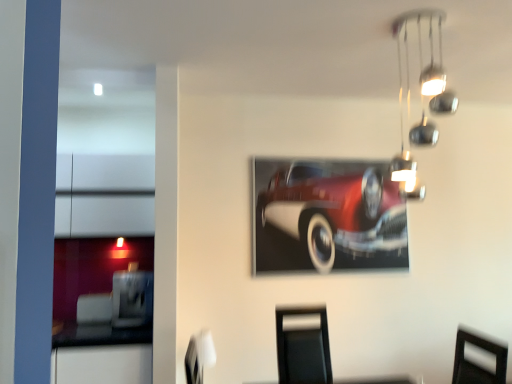
Question: From a real-world perspective, is shiny red car at center physically above white fabric swivel chair at lower center?

Choices:
 (A) yes
 (B) no

Answer: (A)

Question: Does shiny red car at center have a lesser height compared to white fabric swivel chair at lower center?

Choices:
 (A) yes
 (B) no

Answer: (B)

Question: Is shiny red car at center wider than white fabric swivel chair at lower center?

Choices:
 (A) yes
 (B) no

Answer: (B)

Question: Is white fabric swivel chair at lower center at the back of shiny red car at center?

Choices:
 (A) yes
 (B) no

Answer: (B)

Question: From the image's perspective, would you say shiny red car at center is positioned over white fabric swivel chair at lower center?

Choices:
 (A) yes
 (B) no

Answer: (A)

Question: From the image's perspective, is shiny red car at center positioned above or below white fabric swivel chair at lower center?

Choices:
 (A) below
 (B) above

Answer: (B)

Question: Considering the positions of shiny red car at center and white fabric swivel chair at lower center in the image, is shiny red car at center taller or shorter than white fabric swivel chair at lower center?

Choices:
 (A) tall
 (B) short

Answer: (A)

Question: Would you say shiny red car at center is to the left or to the right of white fabric swivel chair at lower center in the picture?

Choices:
 (A) right
 (B) left

Answer: (A)

Question: In terms of size, does shiny red car at center appear bigger or smaller than white fabric swivel chair at lower center?

Choices:
 (A) big
 (B) small

Answer: (A)

Question: Looking at the image, does white fabric swivel chair at lower center seem bigger or smaller compared to chrome metallic light fixture at upper right?

Choices:
 (A) big
 (B) small

Answer: (B)

Question: From their relative heights in the image, would you say white fabric swivel chair at lower center is taller or shorter than chrome metallic light fixture at upper right?

Choices:
 (A) short
 (B) tall

Answer: (A)

Question: Does point (203, 339) appear closer or farther from the camera than point (397, 168)?

Choices:
 (A) farther
 (B) closer

Answer: (B)

Question: From a real-world perspective, is white fabric swivel chair at lower center physically located above or below chrome metallic light fixture at upper right?

Choices:
 (A) above
 (B) below

Answer: (B)

Question: Is white fabric swivel chair at lower center inside the boundaries of shiny red car at center, or outside?

Choices:
 (A) inside
 (B) outside

Answer: (B)

Question: Considering their positions, is white fabric swivel chair at lower center located in front of or behind shiny red car at center?

Choices:
 (A) front
 (B) behind

Answer: (A)